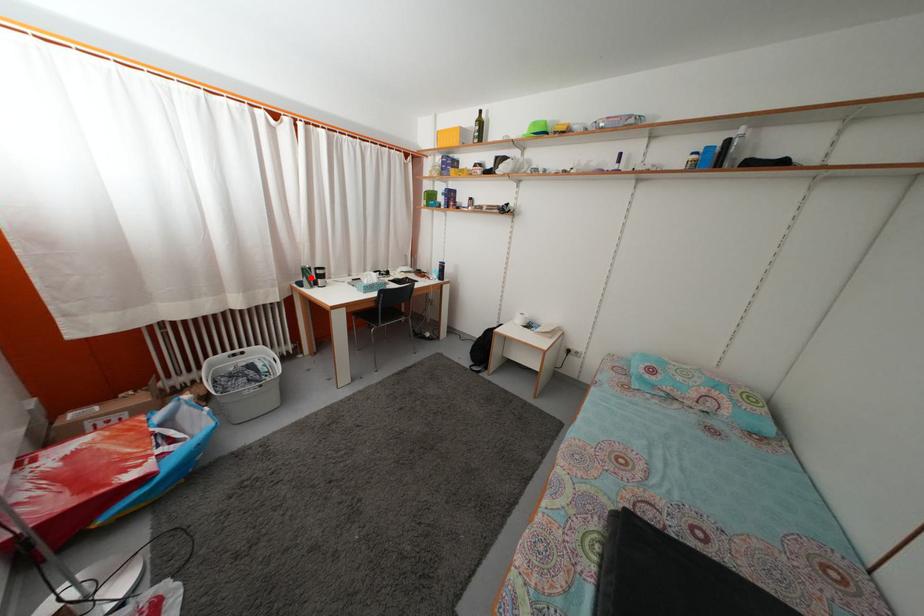
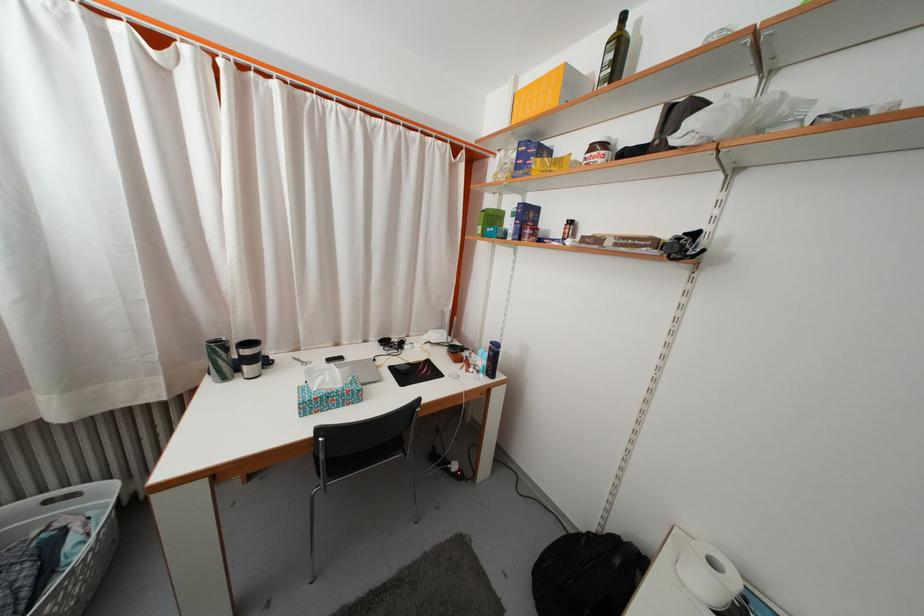
Question: I am providing you with two images of the same scene from different viewpoints. In image1, a red point is highlighted. Considering the same 3D point in image2, which of the following is correct?

Choices:
 (A) It is closer
 (B) It is farther

Answer: (B)